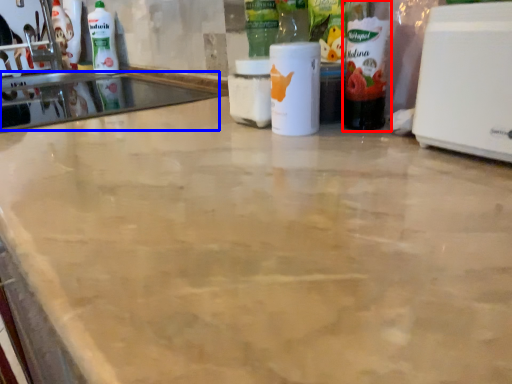
Question: Which object is further to the camera taking this photo, bottle (highlighted by a red box) or sink (highlighted by a blue box)?

Choices:
 (A) bottle
 (B) sink

Answer: (B)